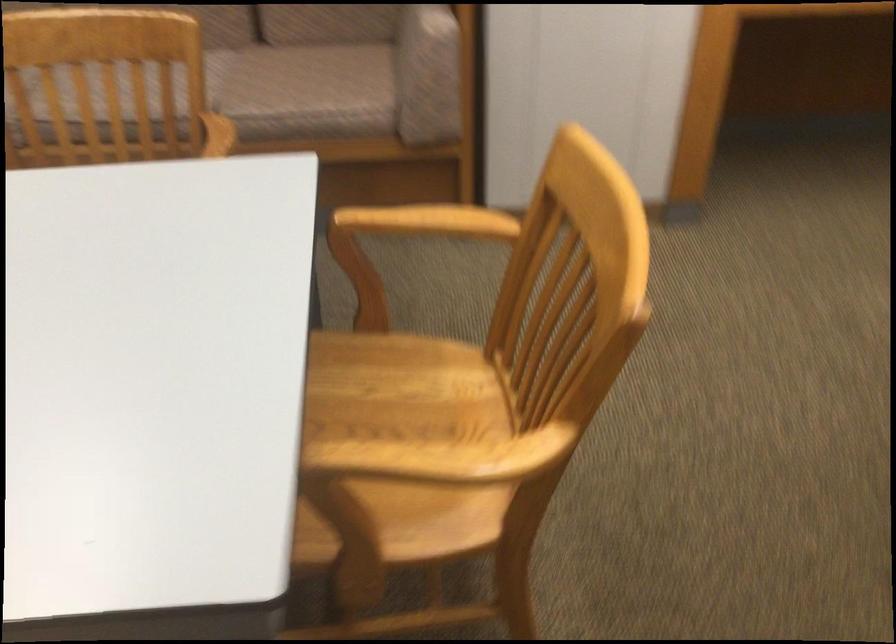
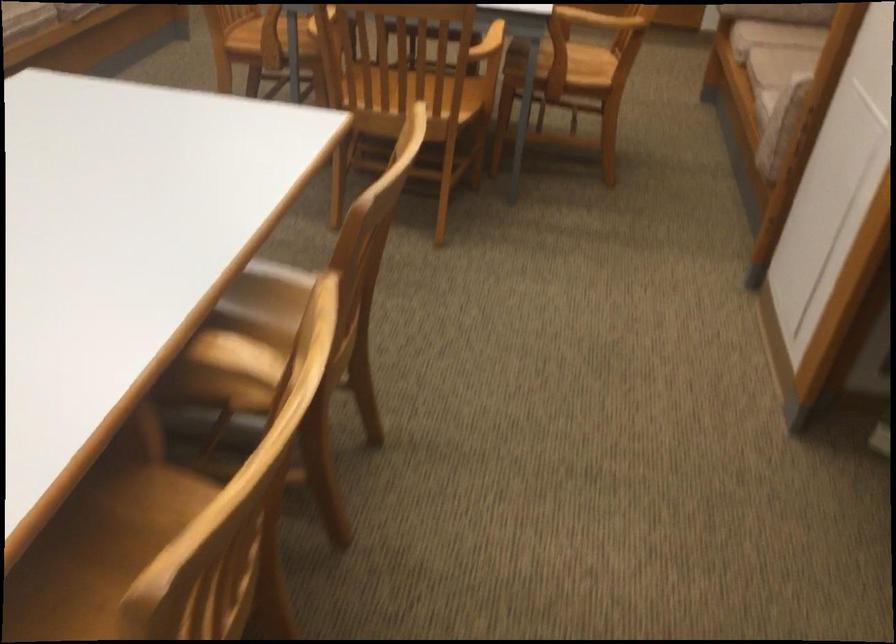
The point at (x=458, y=220) is marked in the first image. Where is the corresponding point in the second image?

(488, 43)